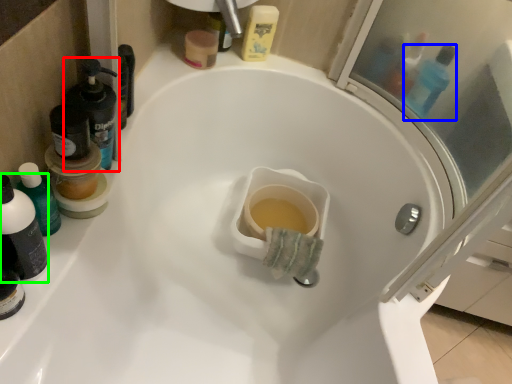
Question: Estimate the real-world distances between objects in this image. Which object is closer to mouthwash (highlighted by a red box), mouthwash (highlighted by a blue box) or mouthwash (highlighted by a green box)?

Choices:
 (A) mouthwash
 (B) mouthwash

Answer: (B)